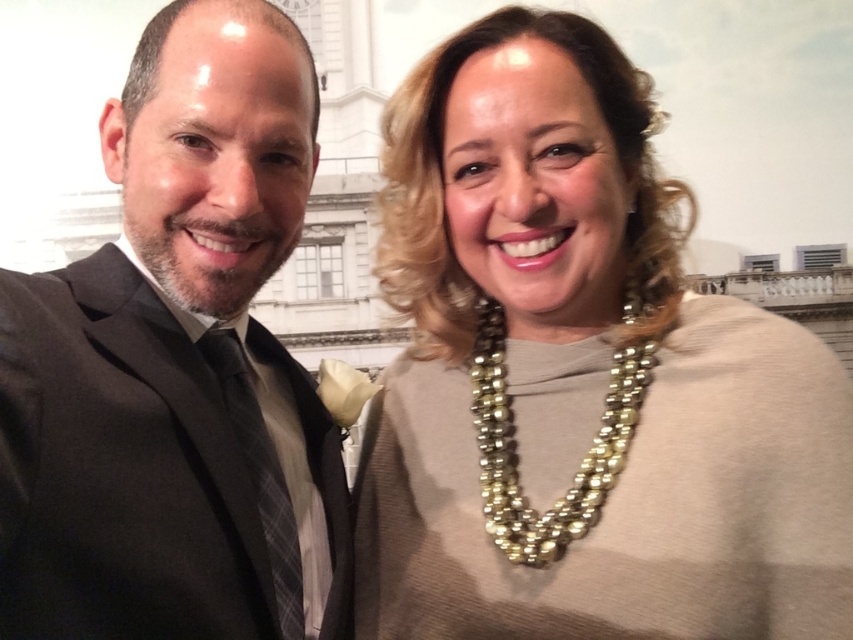
Question: Estimate the real-world distances between objects in this image. Which object is closer to the matte gold necklace at center?

Choices:
 (A) pearl-like beads necklace at upper center
 (B) black satin suit at left

Answer: (A)

Question: Can you confirm if black satin suit at left is positioned to the right of pearl-like beads necklace at upper center?

Choices:
 (A) no
 (B) yes

Answer: (A)

Question: Is matte gold necklace at center thinner than black satin suit at left?

Choices:
 (A) no
 (B) yes

Answer: (A)

Question: Which point appears farthest from the camera in this image?

Choices:
 (A) (537, 362)
 (B) (485, 326)

Answer: (B)

Question: Which object is farther from the camera taking this photo?

Choices:
 (A) pearl-like beads necklace at upper center
 (B) matte gold necklace at center

Answer: (A)

Question: Does black satin suit at left have a smaller size compared to pearl-like beads necklace at upper center?

Choices:
 (A) yes
 (B) no

Answer: (B)